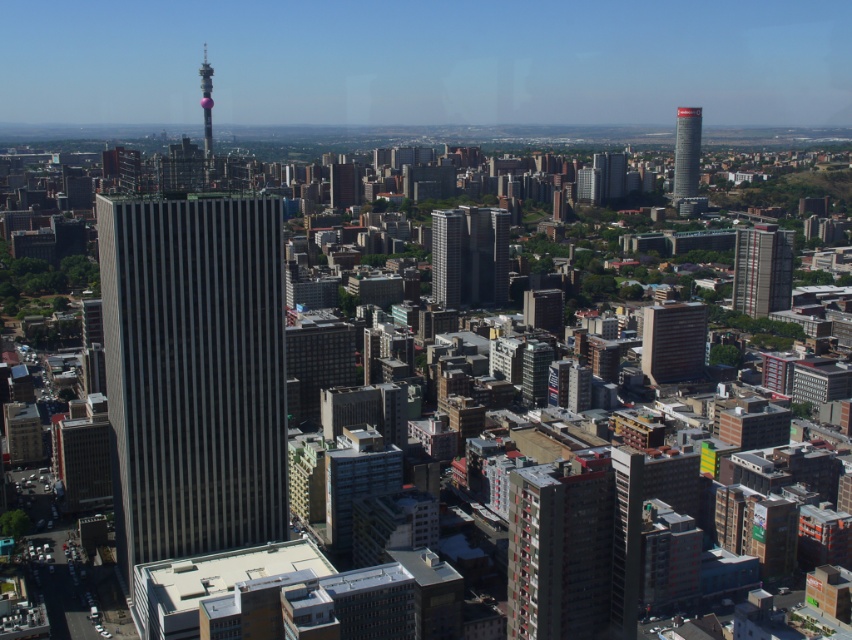
You are a city planner analyzing the urban layout. You notice the red brick building at right and the metallic glass tower at center. Which structure has a greater horizontal span when viewed from above?

The red brick building at right has a greater horizontal span than the metallic glass tower at center because its width surpasses the tower.

You are a drone operator flying a drone over the city. You need to deliver a package to the red brick building at center. However, there is another red brick building at right in the way. From your current position, which building is closer to you?

The red brick building at center is in front of the red brick building at right, so the red brick building at center is closer to you.

You are a drone operator trying to capture a photo of the red brick building at right and the metallic glass tower at center. From your current position, which building appears closer to you?

The red brick building at right appears closer because it is further to the viewer than the metallic glass tower at center, meaning it is positioned in front of the tower in the scene.